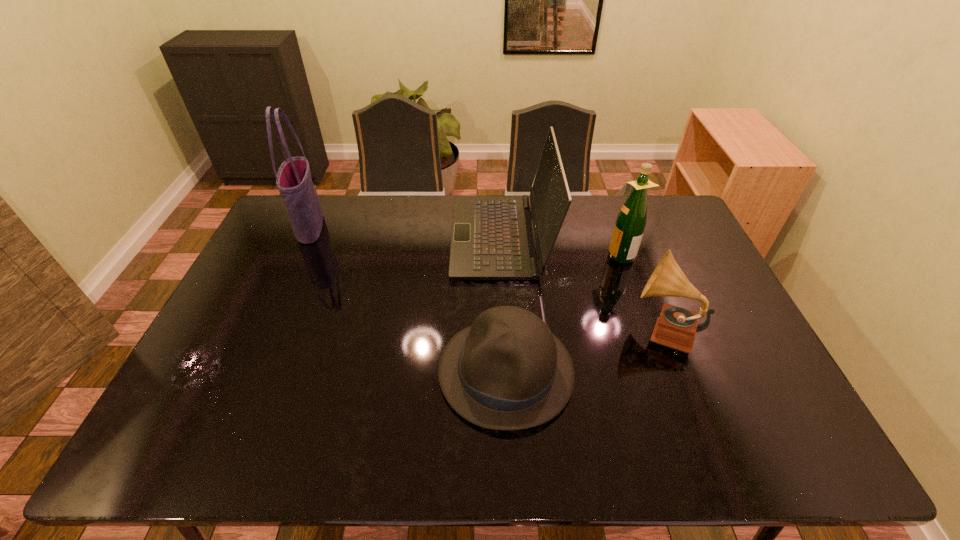
You are a GUI agent. You are given a task and a screenshot of the screen. Output one action in this format:
    pyautogui.click(x=<x>, y=<y>)
    Task: Click on the laptop computer at the far edge
    
    Given the screenshot: What is the action you would take?
    pyautogui.click(x=492, y=238)

The width and height of the screenshot is (960, 540). What are the coordinates of `object that is at the near edge` in the screenshot? It's located at (508, 371).

At what (x,y) coordinates should I click in order to perform the action: click on object at the left edge. Please return your answer as a coordinate pair (x, y). The image size is (960, 540). Looking at the image, I should click on (293, 179).

Identify the location of object at the right edge. The height and width of the screenshot is (540, 960). (676, 327).

Locate an element on the screen. object that is at the far left corner is located at coordinates (293, 179).

In the image, there is a desktop. At what (x,y) coordinates should I click in order to perform the action: click on vacant space at the far edge. Please return your answer as a coordinate pair (x, y). This screenshot has width=960, height=540. Looking at the image, I should click on (340, 229).

The image size is (960, 540). In the image, there is a desktop. Identify the location of vacant space at the near edge. (454, 462).

The width and height of the screenshot is (960, 540). I want to click on vacant space at the left edge of the desktop, so click(x=278, y=258).

The image size is (960, 540). In order to click on free spot at the near left corner of the desktop in this screenshot , I will do `click(217, 445)`.

You are a GUI agent. You are given a task and a screenshot of the screen. Output one action in this format:
    pyautogui.click(x=<x>, y=<y>)
    Task: Click on the vacant space at the far right corner of the desktop
    The image size is (960, 540).
    Given the screenshot: What is the action you would take?
    pyautogui.click(x=650, y=231)